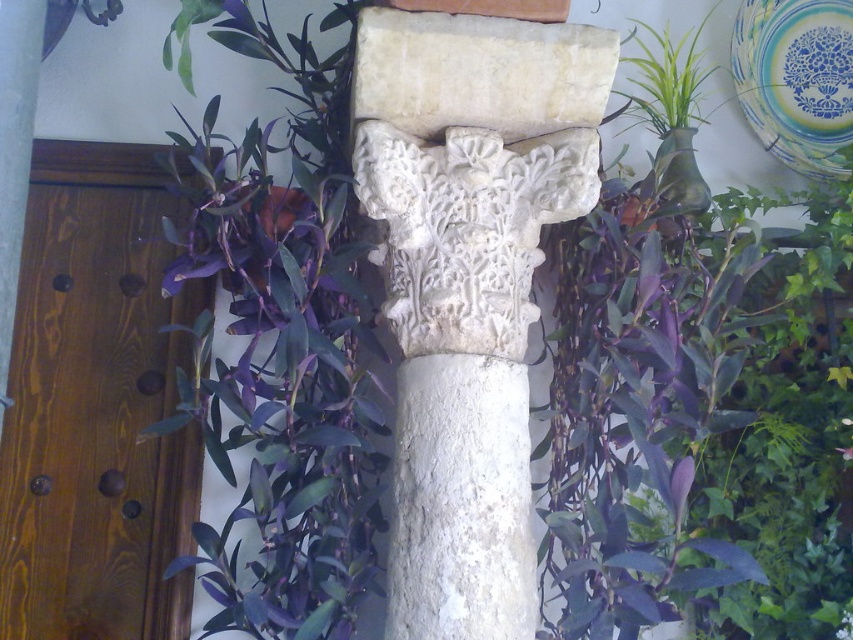
From the picture: You are standing in the interior space shown in the image. If you face the white stone column at center, which direction should you turn to exit through the wooden door on the left?

The white stone column at center is located at coordinates approximately 0.447 along the x and 0.550 along the y axis. Since the wooden door is on the left side of the column, you should turn left to exit through the wooden door on the left.

You are standing in the room and want to place a small potted plant exactly at point (468, 285). What object will be at that location if you do so?

The white stone column at center is already located at point (468, 285), so placing the potted plant there would displace it.

You are an interior designer planning to place a large sculpture in this space. The sculpture requires a base that is larger than the white stone column at center. Can the purple leafy plant at center be used as a reference for the minimum size needed for the sculpture base?

The purple leafy plant at center is larger than the white stone column at center, so using the purple leafy plant at center as a reference would ensure the sculpture base meets the size requirement.